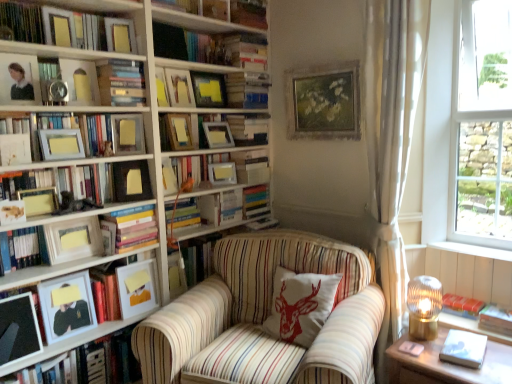
I want to click on free space in front of hardcover book at right, the 4th book when ordered from bottom to top, so click(461, 324).